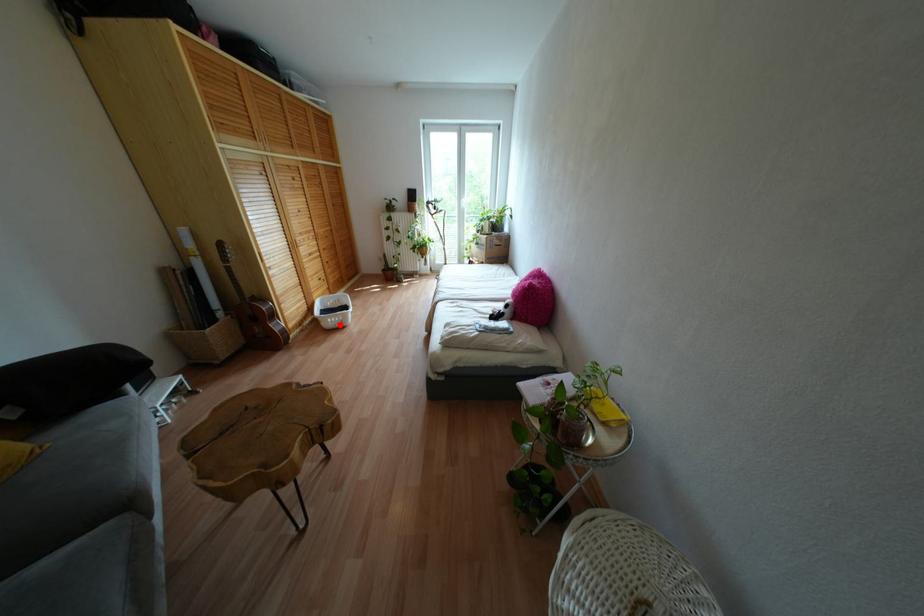
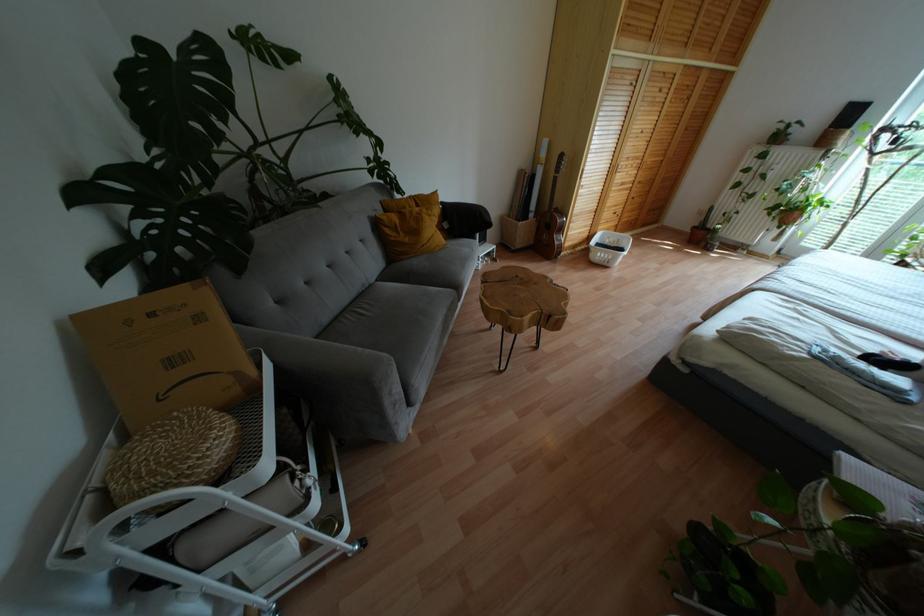
Question: I am providing you with two images of the same scene from different viewpoints. Image1 has a red point marked. In image2, the corresponding 3D location appears at what relative position? Reply with the corresponding letter.

Choices:
 (A) Closer
 (B) Farther

Answer: (B)